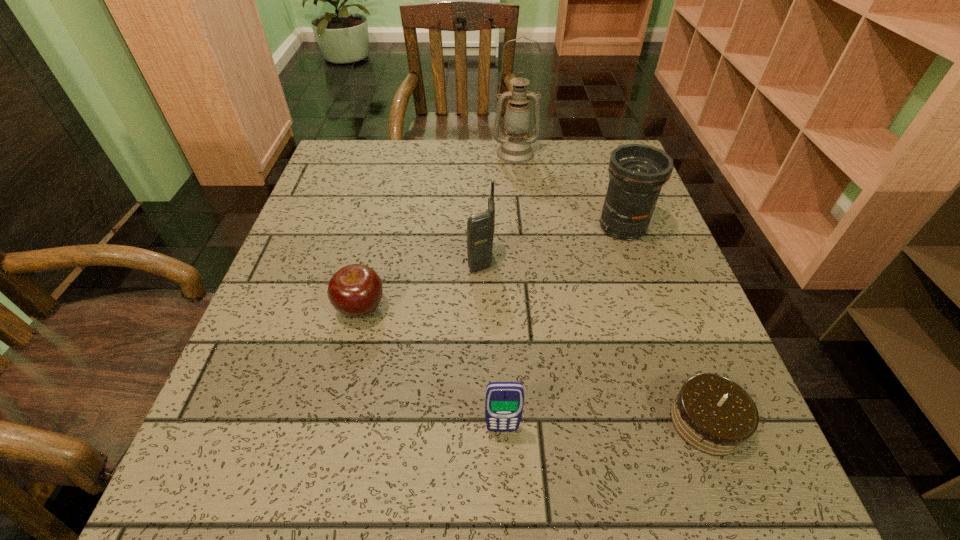
At what (x,y) coordinates should I click in order to perform the action: click on chocolate cake present at the right edge. Please return your answer as a coordinate pair (x, y). This screenshot has width=960, height=540. Looking at the image, I should click on (714, 415).

Where is `free space at the far edge of the desktop`? The width and height of the screenshot is (960, 540). free space at the far edge of the desktop is located at coordinates (470, 146).

At what (x,y) coordinates should I click in order to perform the action: click on free space at the near edge. Please return your answer as a coordinate pair (x, y). The height and width of the screenshot is (540, 960). Looking at the image, I should click on (461, 474).

At what (x,y) coordinates should I click in order to perform the action: click on vacant space at the left edge. Please return your answer as a coordinate pair (x, y). The image size is (960, 540). Looking at the image, I should click on [x=331, y=314].

The image size is (960, 540). In the image, there is a desktop. What are the coordinates of `vacant space at the right edge` in the screenshot? It's located at (687, 287).

The height and width of the screenshot is (540, 960). In the image, there is a desktop. What are the coordinates of `free space at the far left corner` in the screenshot? It's located at (392, 139).

Where is `vacant space at the far right corner of the desktop`? The width and height of the screenshot is (960, 540). vacant space at the far right corner of the desktop is located at coordinates (596, 154).

I want to click on free point between the shortest object and the fourth tallest object, so click(x=605, y=426).

What are the coordinates of `free spot between the third nearest object and the taller cellular telephone` in the screenshot? It's located at (421, 284).

Where is `free spot between the fourth tallest object and the third farthest object`? The height and width of the screenshot is (540, 960). free spot between the fourth tallest object and the third farthest object is located at coordinates (492, 345).